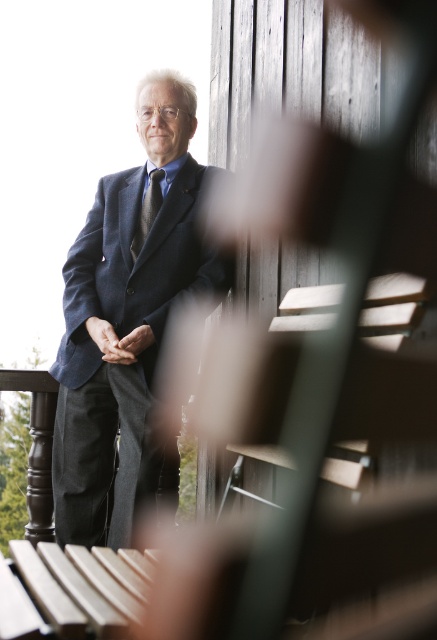
Question: Which point appears closest to the camera in this image?

Choices:
 (A) (144, 209)
 (B) (176, 477)

Answer: (A)

Question: Is dark blue suit at center closer to camera compared to dark gray textured tie at center?

Choices:
 (A) no
 (B) yes

Answer: (B)

Question: Does dark blue suit at center appear over dark gray textured tie at center?

Choices:
 (A) no
 (B) yes

Answer: (A)

Question: Does dark blue suit at center have a lesser width compared to dark gray textured tie at center?

Choices:
 (A) yes
 (B) no

Answer: (B)

Question: Which of the following is the farthest from the observer?

Choices:
 (A) (135, 234)
 (B) (110, 241)

Answer: (B)

Question: Among these objects, which one is farthest from the camera?

Choices:
 (A) dark gray textured tie at center
 (B) dark blue suit at center

Answer: (A)